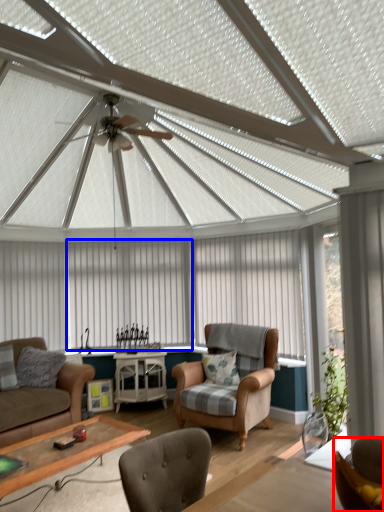
Question: Among these objects, which one is nearest to the camera, chair (highlighted by a red box) or curtain (highlighted by a blue box)?

Choices:
 (A) chair
 (B) curtain

Answer: (A)